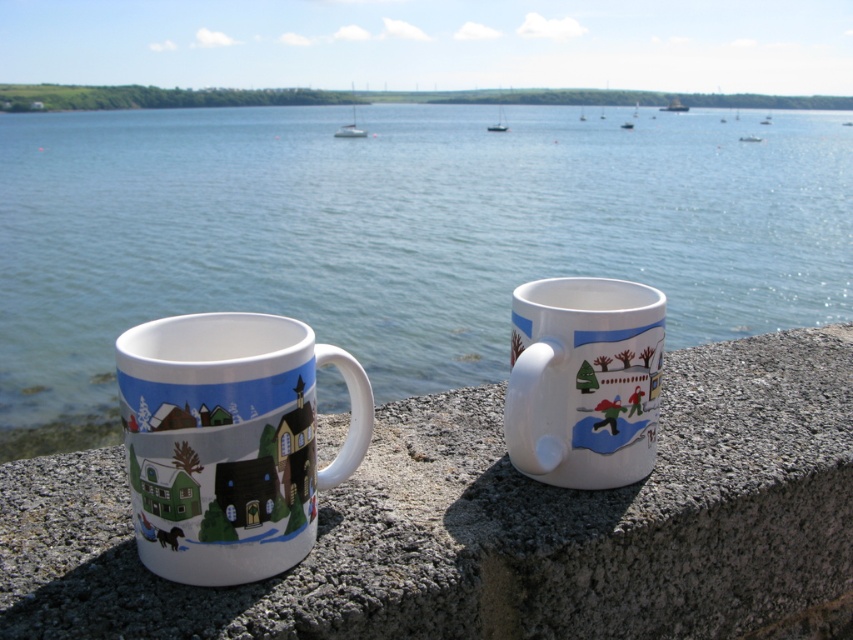
Which is more to the left, blue water at center or granite ledge at center?

From the viewer's perspective, granite ledge at center appears more on the left side.

Measure the distance between blue water at center and granite ledge at center.

They are 13.64 feet apart.

Locate an element on the screen. blue water at center is located at coordinates (395, 234).

The height and width of the screenshot is (640, 853). Describe the element at coordinates (395, 234) in the screenshot. I see `blue water at center` at that location.

Can you confirm if blue water at center is positioned above metallic silver boat at upper center?

No, blue water at center is not above metallic silver boat at upper center.

What do you see at coordinates (395, 234) in the screenshot? The width and height of the screenshot is (853, 640). I see `blue water at center` at bounding box center [395, 234].

You are a GUI agent. You are given a task and a screenshot of the screen. Output one action in this format:
    pyautogui.click(x=<x>, y=<y>)
    Task: Click on the blue water at center
    
    Given the screenshot: What is the action you would take?
    pos(395,234)

Which of these two, blue water at center or white glossy mug at right, stands shorter?

white glossy mug at right

Can you confirm if blue water at center is thinner than white glossy mug at right?

Incorrect, blue water at center's width is not less than white glossy mug at right's.

Which is in front, point (7, 148) or point (532, 461)?

Point (532, 461)

Find the location of a particular element. The image size is (853, 640). blue water at center is located at coordinates pyautogui.click(x=395, y=234).